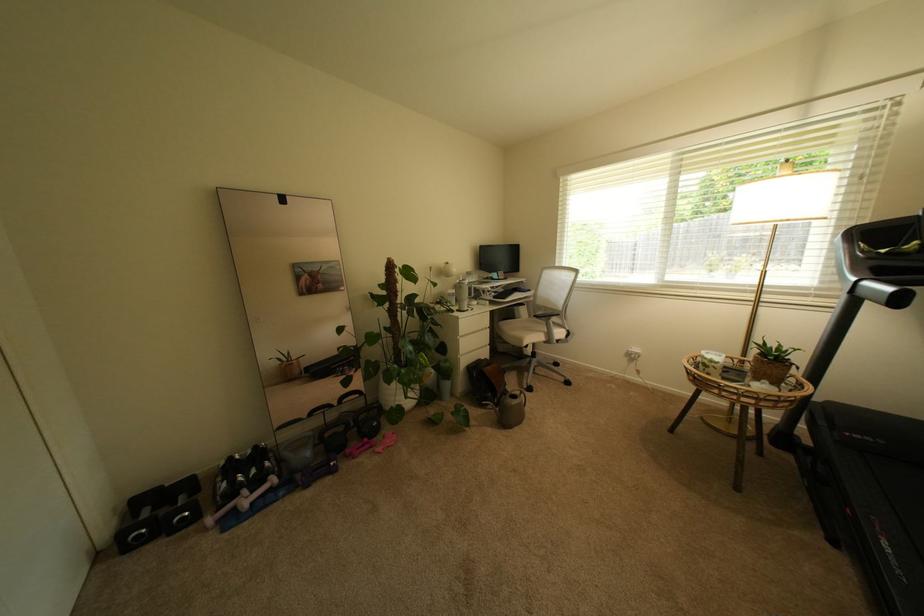
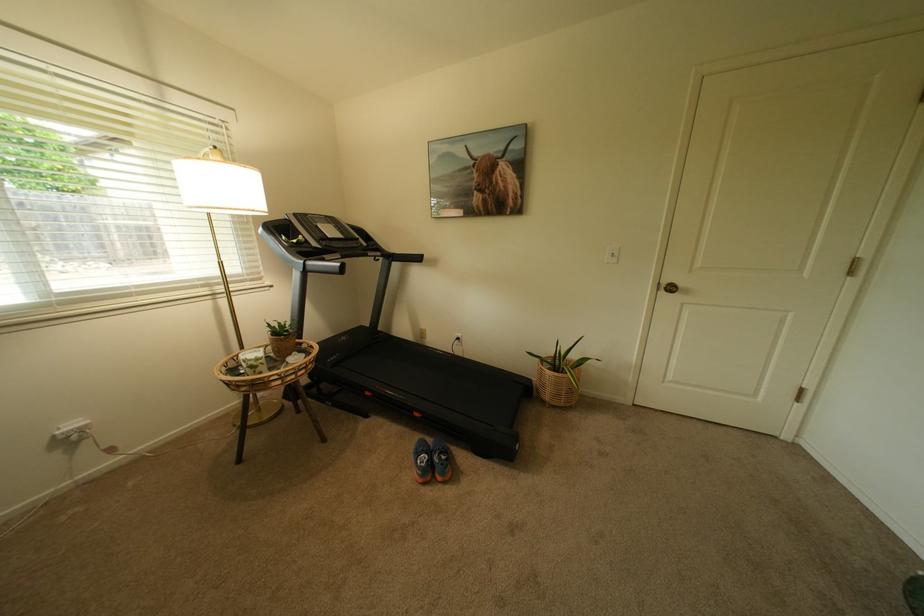
Based on the continuous images, in which direction is the camera rotating?

The camera's rotation is toward right-down.